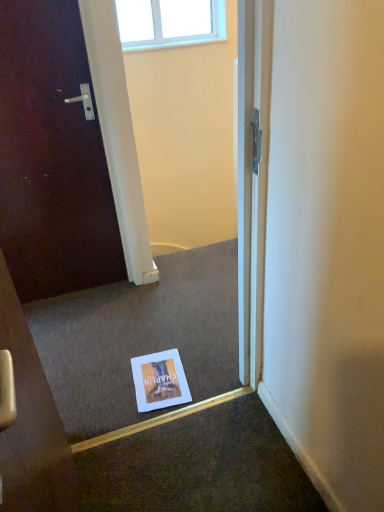
In order to click on clear glass window at upper center in this screenshot , I will do `click(169, 22)`.

The width and height of the screenshot is (384, 512). Describe the element at coordinates (169, 22) in the screenshot. I see `clear glass window at upper center` at that location.

In order to face white paper flyer at center, should I rotate leftwards or rightwards?

Rotate left and turn 4.396 degrees.

The height and width of the screenshot is (512, 384). Describe the element at coordinates (159, 381) in the screenshot. I see `white paper flyer at center` at that location.

This screenshot has height=512, width=384. I want to click on white paper flyer at center, so click(x=159, y=381).

Measure the distance between white paper flyer at center and camera.

white paper flyer at center is 5.34 feet from camera.

The width and height of the screenshot is (384, 512). Identify the location of clear glass window at upper center. (169, 22).

Considering the relative positions of clear glass window at upper center and white paper flyer at center in the image provided, is clear glass window at upper center to the left or to the right of white paper flyer at center?

clear glass window at upper center is positioned on white paper flyer at center's left side.

Based on the photo, who is more distant, clear glass window at upper center or white paper flyer at center?

Positioned behind is clear glass window at upper center.

Is point (190, 22) more distant than point (177, 380)?

Yes, it is.

From the image's perspective, which one is positioned lower, clear glass window at upper center or white paper flyer at center?

From the image's view, white paper flyer at center is below.

From a real-world perspective, relative to white paper flyer at center, is clear glass window at upper center vertically above or below?

From a real-world perspective, clear glass window at upper center is physically above white paper flyer at center.

Which of these two, clear glass window at upper center or white paper flyer at center, is wider?

white paper flyer at center is wider.

Can you confirm if clear glass window at upper center is taller than white paper flyer at center?

Correct, clear glass window at upper center is much taller as white paper flyer at center.

Which of these two, clear glass window at upper center or white paper flyer at center, is smaller?

white paper flyer at center.

Is clear glass window at upper center not within white paper flyer at center?

clear glass window at upper center is positioned outside white paper flyer at center.

Is the surface of clear glass window at upper center in direct contact with white paper flyer at center?

No, clear glass window at upper center is not in contact with white paper flyer at center.

Is clear glass window at upper center aimed at white paper flyer at center?

No.

You are a GUI agent. You are given a task and a screenshot of the screen. Output one action in this format:
    pyautogui.click(x=<x>, y=<y>)
    Task: Click on the flyer lying on the right of clear glass window at upper center
    The image size is (384, 512).
    Given the screenshot: What is the action you would take?
    pyautogui.click(x=159, y=381)

Which object is positioned more to the left, white paper flyer at center or clear glass window at upper center?

From the viewer's perspective, clear glass window at upper center appears more on the left side.

Is white paper flyer at center closer to the viewer compared to clear glass window at upper center?

Yes, it is.

Which is less distant, (138, 385) or (179, 24)?

The point (138, 385) is closer to the camera.

From the image's perspective, is white paper flyer at center positioned above or below clear glass window at upper center?

Based on their image positions, white paper flyer at center is located beneath clear glass window at upper center.

From a real-world perspective, relative to clear glass window at upper center, is white paper flyer at center vertically above or below?

In terms of real-world spatial position, white paper flyer at center is below clear glass window at upper center.

In terms of width, does white paper flyer at center look wider or thinner when compared to clear glass window at upper center?

white paper flyer at center is wider than clear glass window at upper center.

Is white paper flyer at center taller or shorter than clear glass window at upper center?

white paper flyer at center is shorter than clear glass window at upper center.

Does white paper flyer at center have a smaller size compared to clear glass window at upper center?

Yes.

Does white paper flyer at center contain clear glass window at upper center?

No.

Are white paper flyer at center and clear glass window at upper center far apart?

Indeed, white paper flyer at center is not near clear glass window at upper center.

Based on the photo, is white paper flyer at center oriented towards clear glass window at upper center?

No, white paper flyer at center does not turn towards clear glass window at upper center.

What's the angular difference between white paper flyer at center and clear glass window at upper center's facing directions?

There is a 5.02-degree angle between the facing directions of white paper flyer at center and clear glass window at upper center.

Identify the location of flyer lying on the right of clear glass window at upper center. This screenshot has width=384, height=512. (159, 381).

The width and height of the screenshot is (384, 512). I want to click on window above the white paper flyer at center (from the image's perspective), so click(x=169, y=22).

In order to click on window above the white paper flyer at center (from a real-world perspective) in this screenshot , I will do 169,22.